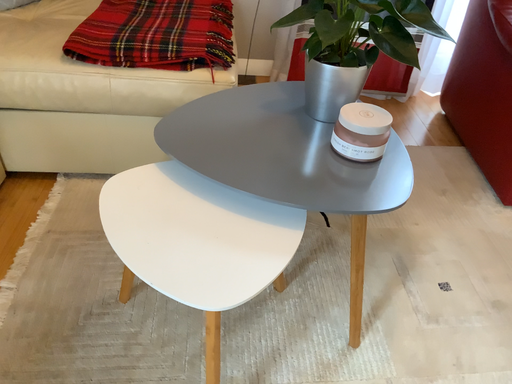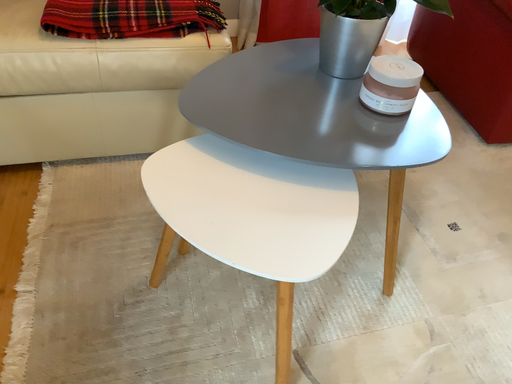
Question: Which way did the camera rotate in the video?

Choices:
 (A) rotated right
 (B) rotated left

Answer: (A)